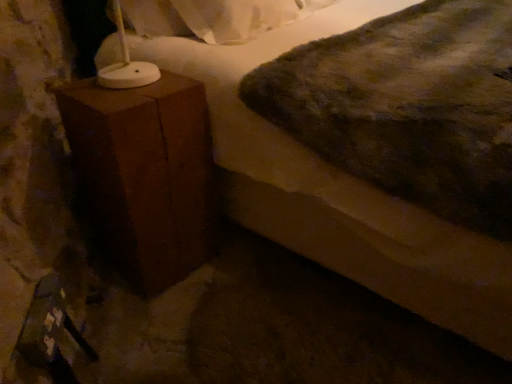
At what (x,y) coordinates should I click in order to perform the action: click on brown wood side table at left. Please return your answer as a coordinate pair (x, y). The image size is (512, 384). Looking at the image, I should click on (145, 174).

What is the approximate width of brown wood side table at left?

12.59 inches.

This screenshot has height=384, width=512. Describe the element at coordinates (145, 174) in the screenshot. I see `brown wood side table at left` at that location.

What are the coordinates of `brown wood side table at left` in the screenshot? It's located at (145, 174).